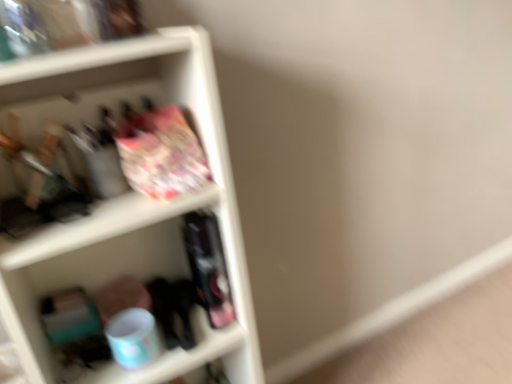
Image resolution: width=512 pixels, height=384 pixels. What do you see at coordinates (132, 210) in the screenshot? I see `matte plastic bag at upper left` at bounding box center [132, 210].

In order to click on matte plastic bag at upper left in this screenshot , I will do `click(132, 210)`.

Where is `matte plastic bag at upper left`? matte plastic bag at upper left is located at coordinates (132, 210).